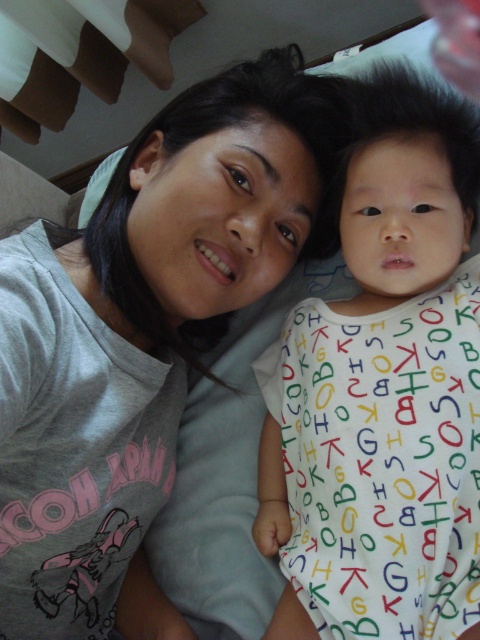
Can you confirm if gray cotton t-shirt at upper left is taller than white cotton onesie at center?

Yes, gray cotton t-shirt at upper left is taller than white cotton onesie at center.

Is gray cotton t-shirt at upper left below white cotton onesie at center?

Incorrect, gray cotton t-shirt at upper left is not positioned below white cotton onesie at center.

Who is more forward, [192,168] or [304,435]?

Positioned in front is point [192,168].

Locate an element on the screen. gray cotton t-shirt at upper left is located at coordinates (142, 333).